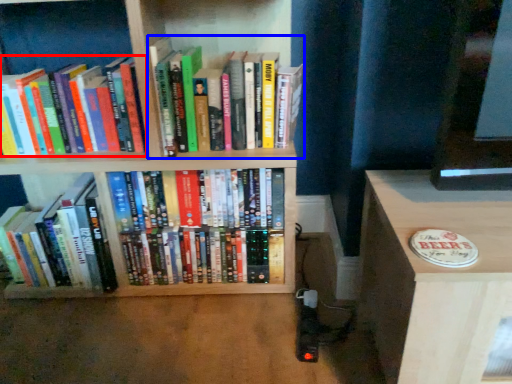
Question: Which point is further to the camera, book (highlighted by a red box) or book (highlighted by a blue box)?

Choices:
 (A) book
 (B) book

Answer: (A)